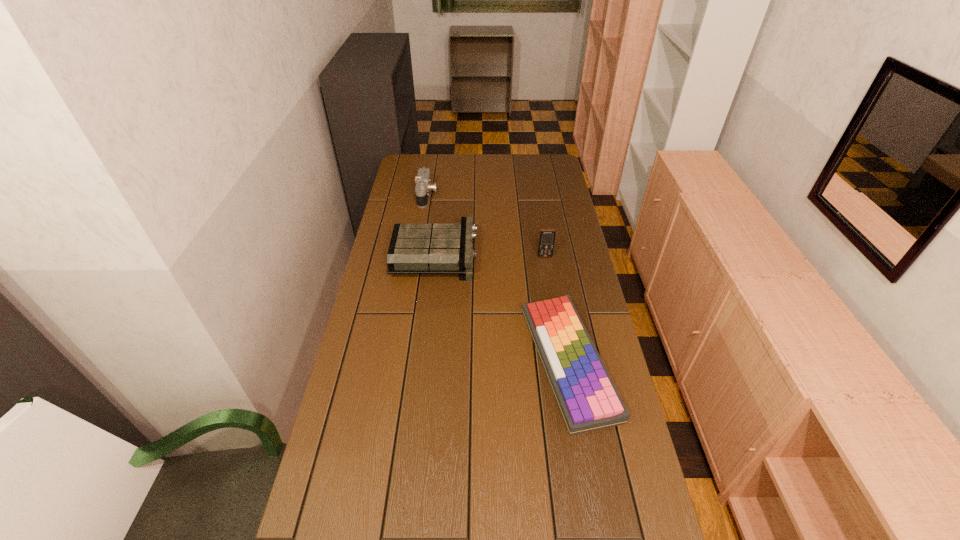
The image size is (960, 540). In order to click on radio receiver that is positioned at the left edge in this screenshot , I will do `click(414, 248)`.

This screenshot has width=960, height=540. I want to click on cellular telephone situated at the right edge, so click(x=547, y=236).

Find the location of a particular element. The width and height of the screenshot is (960, 540). computer keyboard that is at the right edge is located at coordinates (588, 400).

I want to click on vacant area at the far edge, so click(x=488, y=156).

In order to click on vacant space at the left edge in this screenshot , I will do `click(386, 259)`.

The width and height of the screenshot is (960, 540). I want to click on free region at the right edge, so click(587, 303).

Where is `free region at the far left corner of the desktop`? The width and height of the screenshot is (960, 540). free region at the far left corner of the desktop is located at coordinates (432, 170).

Identify the location of free space between the computer keyboard and the camera. The height and width of the screenshot is (540, 960). (497, 278).

Where is `free space between the radio receiver and the tallest object`? free space between the radio receiver and the tallest object is located at coordinates (491, 256).

At what (x,y) coordinates should I click in order to perform the action: click on free area in between the tallest object and the camera. Please return your answer as a coordinate pair (x, y). The width and height of the screenshot is (960, 540). Looking at the image, I should click on (486, 226).